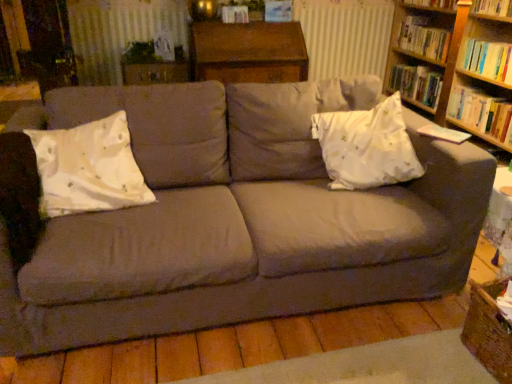
I want to click on free space on the front side of hardcover book at upper center, so click(227, 24).